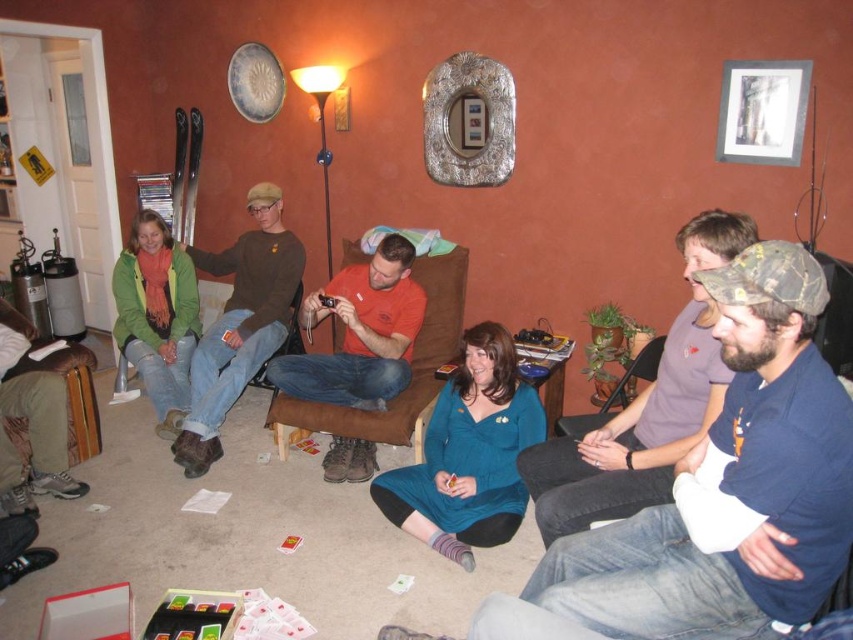
Question: Which is farther from the brown sweater at upper left?

Choices:
 (A) brown leather armchair at lower left
 (B) dark blue shirt at center
 (C) orange cotton shirt at center

Answer: (B)

Question: Is orange cotton shirt at center wider than brown leather armchair at lower left?

Choices:
 (A) no
 (B) yes

Answer: (B)

Question: Which point is closer to the camera?

Choices:
 (A) (610, 513)
 (B) (413, 248)

Answer: (A)

Question: Estimate the real-world distances between objects in this image. Which object is closer to the orange cotton shirt at center?

Choices:
 (A) brown sweater at upper left
 (B) dark blue shirt at center

Answer: (A)

Question: Can you confirm if orange cotton shirt at center is positioned above brown leather armchair at lower left?

Choices:
 (A) yes
 (B) no

Answer: (A)

Question: Does dark blue shirt at center have a lesser width compared to brown leather armchair at lower left?

Choices:
 (A) yes
 (B) no

Answer: (B)